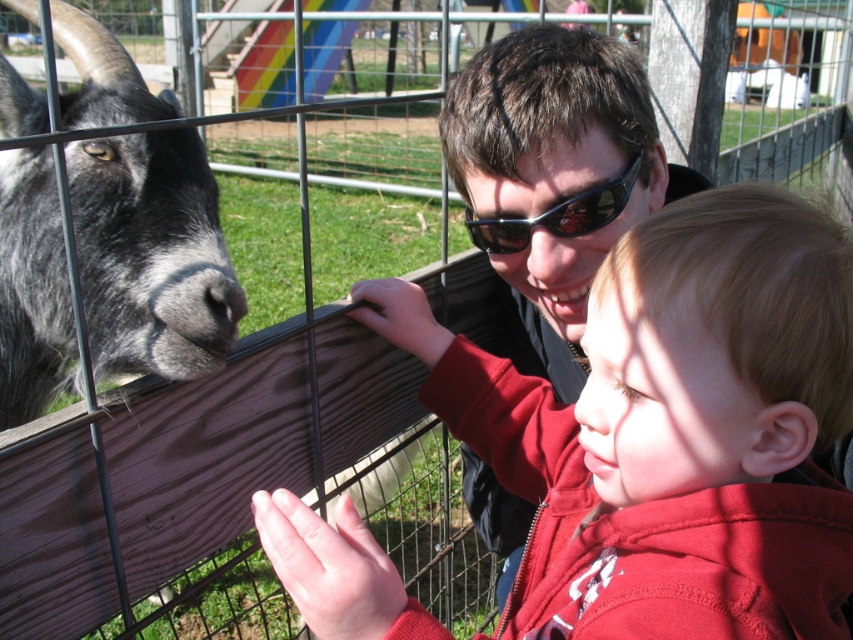
Can you confirm if gray woolen goat at left is smaller than sunglasses at center?

No, gray woolen goat at left is not smaller than sunglasses at center.

This screenshot has height=640, width=853. I want to click on gray woolen goat at left, so click(x=151, y=253).

Is point (103, 275) less distant than point (578, 225)?

Yes.

Locate an element on the screen. The width and height of the screenshot is (853, 640). gray woolen goat at left is located at coordinates (151, 253).

Is matte red hoodie at center to the right of gray woolen goat at left from the viewer's perspective?

Yes, matte red hoodie at center is to the right of gray woolen goat at left.

Measure the distance between point (666, 429) and camera.

Point (666, 429) is 27.71 inches away from camera.

The height and width of the screenshot is (640, 853). What are the coordinates of `matte red hoodie at center` in the screenshot? It's located at (672, 428).

Does matte red hoodie at center come in front of sunglasses at center?

Yes.

Between point (323, 616) and point (608, 209), which one is positioned behind?

The point (608, 209) is more distant.

Image resolution: width=853 pixels, height=640 pixels. Identify the location of matte red hoodie at center. (672, 428).